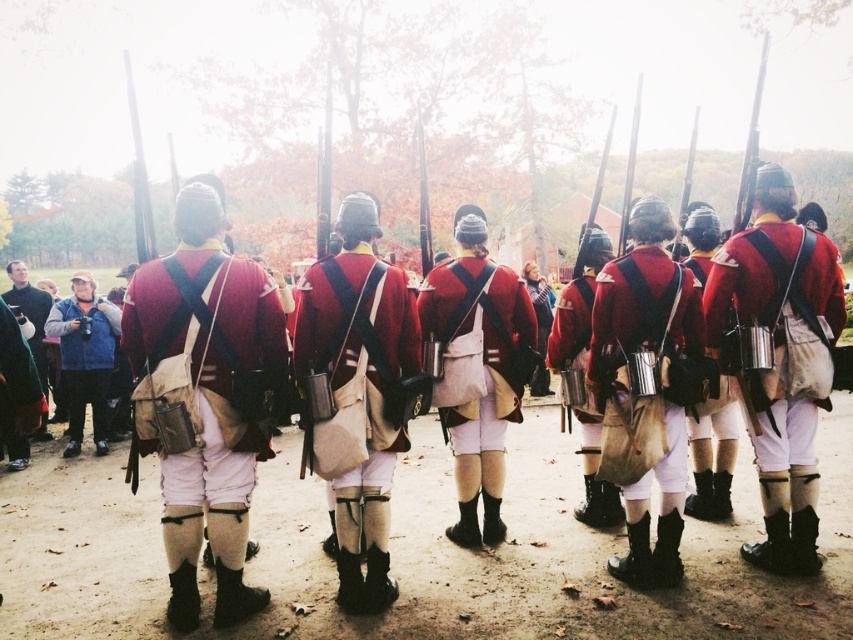
You are a soldier in the formation and need to reach for your matte leather canteen at center. Which direction should you turn to access it since it is positioned behind matte red cloth uniform at center?

The matte leather canteen at center is behind the matte red cloth uniform at center, so you should turn around to reach it.

You are a soldier in the formation and need to retrieve your hat which is at point (x=85, y=356). Which direction should you move to reach the blue fabric vest at left?

The blue fabric vest at left is located at point (x=85, y=356). Since you are facing away from the camera, moving towards the left would mean turning and heading in the direction of the blue fabric vest at left.